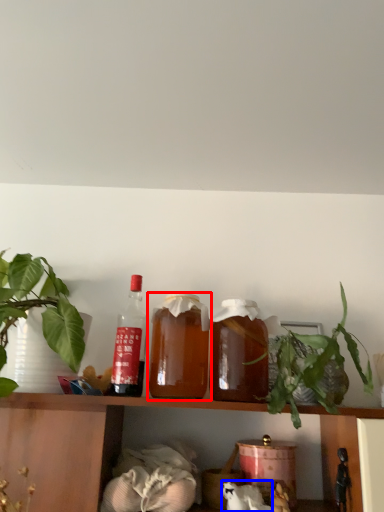
Question: Which object is further to the camera taking this photo, bottle (highlighted by a red box) or animal (highlighted by a blue box)?

Choices:
 (A) bottle
 (B) animal

Answer: (B)